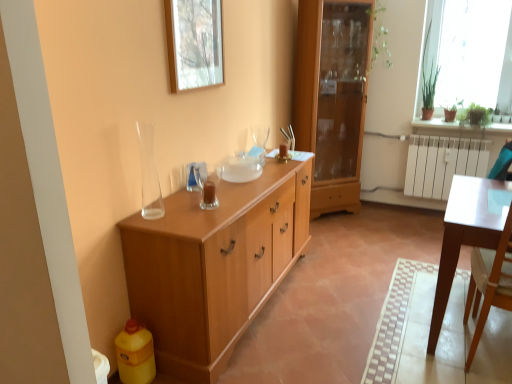
You are a GUI agent. You are given a task and a screenshot of the screen. Output one action in this format:
    pyautogui.click(x=<x>, y=<y>)
    Task: Click on the translucent glass candle at center
    The width and height of the screenshot is (512, 384).
    Given the screenshot: What is the action you would take?
    pyautogui.click(x=208, y=186)

Image resolution: width=512 pixels, height=384 pixels. What do you see at coordinates (332, 97) in the screenshot? I see `light brown wood cabinet at center` at bounding box center [332, 97].

What do you see at coordinates (194, 43) in the screenshot? I see `wooden picture frame at upper center` at bounding box center [194, 43].

What do you see at coordinates (149, 174) in the screenshot? I see `transparent glass vase at left` at bounding box center [149, 174].

Image resolution: width=512 pixels, height=384 pixels. What do you see at coordinates (489, 283) in the screenshot?
I see `white glossy table at right` at bounding box center [489, 283].

Identify the location of translucent glass candle at center. The height and width of the screenshot is (384, 512). (208, 186).

Is transparent glass vase at left aimed at white glossy table at right?

No, transparent glass vase at left is not turned towards white glossy table at right.

Does point (150, 126) come closer to viewer compared to point (505, 301)?

No, (150, 126) is further to viewer.

Considering the sizes of transparent glass vase at left and white glossy table at right in the image, is transparent glass vase at left taller or shorter than white glossy table at right?

In the image, transparent glass vase at left appears to be shorter than white glossy table at right.

Which of these two, transparent glass vase at left or white glossy table at right, is thinner?

transparent glass vase at left.

From a real-world perspective, which is physically below, white glossy table at right or transparent glass vase at left?

white glossy table at right.

Based on their sizes in the image, would you say white glossy table at right is bigger or smaller than transparent glass vase at left?

Clearly, white glossy table at right is larger in size than transparent glass vase at left.

The image size is (512, 384). I want to click on glass vase behind the white glossy table at right, so click(x=149, y=174).

Which object is more forward, white glossy table at right or transparent glass vase at left?

white glossy table at right.

Would you say transparent glass vase at left is to the left or to the right of wooden picture frame at upper center in the picture?

transparent glass vase at left is to the left of wooden picture frame at upper center.

Is transparent glass vase at left completely or partially outside of wooden picture frame at upper center?

Indeed, transparent glass vase at left is completely outside wooden picture frame at upper center.

How much distance is there between transparent glass vase at left and wooden picture frame at upper center?

They are 20.59 inches apart.

Is light brown wood cabinet at center to the left of wooden cabinet at center from the viewer's perspective?

No, light brown wood cabinet at center is not to the left of wooden cabinet at center.

Is point (321, 110) behind point (165, 294)?

Yes, it is.

Is light brown wood cabinet at center aimed at wooden cabinet at center?

No, light brown wood cabinet at center does not turn towards wooden cabinet at center.

Is wooden picture frame at upper center turned away from transparent glass vase at left?

No, wooden picture frame at upper center's orientation is not away from transparent glass vase at left.

Considering the relative sizes of wooden picture frame at upper center and transparent glass vase at left in the image provided, is wooden picture frame at upper center wider than transparent glass vase at left?

No, wooden picture frame at upper center is not wider than transparent glass vase at left.

Considering the sizes of wooden picture frame at upper center and transparent glass vase at left in the image, is wooden picture frame at upper center taller or shorter than transparent glass vase at left?

Clearly, wooden picture frame at upper center is taller compared to transparent glass vase at left.

How distant is wooden picture frame at upper center from transparent glass vase at left?

wooden picture frame at upper center and transparent glass vase at left are 20.59 inches apart.

Is light brown wood cabinet at center positioned with its back to transparent glass vase at left?

light brown wood cabinet at center is not turned away from transparent glass vase at left.

From their relative heights in the image, would you say light brown wood cabinet at center is taller or shorter than transparent glass vase at left?

Clearly, light brown wood cabinet at center is taller compared to transparent glass vase at left.

Looking at their sizes, would you say light brown wood cabinet at center is wider or thinner than transparent glass vase at left?

Considering their sizes, light brown wood cabinet at center looks broader than transparent glass vase at left.

Is translucent glass candle at center outside of transparent glass vase at left?

That's correct, translucent glass candle at center is outside of transparent glass vase at left.

Does translucent glass candle at center come in front of transparent glass vase at left?

No, it is behind transparent glass vase at left.

Does point (204, 193) come farther from viewer compared to point (156, 180)?

No, it is in front of (156, 180).

Is translucent glass candle at center bigger or smaller than transparent glass vase at left?

Clearly, translucent glass candle at center is smaller in size than transparent glass vase at left.

At what (x,y) coordinates should I click in order to perform the action: click on armchair in front of the transparent glass vase at left. Please return your answer as a coordinate pair (x, y). The image size is (512, 384). Looking at the image, I should click on pyautogui.click(x=489, y=283).

You are a GUI agent. You are given a task and a screenshot of the screen. Output one action in this format:
    pyautogui.click(x=<x>, y=<y>)
    Task: Click on the armchair directly beneath the transparent glass vase at left (from a real-world perspective)
    
    Given the screenshot: What is the action you would take?
    pyautogui.click(x=489, y=283)

Looking at the image, which one is located closer to wooden cabinet at center, light brown wood cabinet at center or white glossy table at right?

Based on the image, white glossy table at right appears to be nearer to wooden cabinet at center.

Looking at the image, which one is located further to transparent glass vase at left, wooden cabinet at center or translucent glass candle at center?

wooden cabinet at center is positioned further to the anchor transparent glass vase at left.

Consider the image. Considering their positions, is wooden picture frame at upper center positioned further to translucent glass candle at center than white glossy table at right?

Based on the image, white glossy table at right appears to be further to translucent glass candle at center.

Based on the photo, based on their spatial positions, is translucent glass candle at center or white glossy table at right further from transparent glass vase at left?

The object further to transparent glass vase at left is white glossy table at right.

Based on their spatial positions, is transparent glass vase at left or wooden picture frame at upper center closer to translucent glass candle at center?

transparent glass vase at left.

When comparing their distances from translucent glass candle at center, does wooden picture frame at upper center or transparent glass vase at left seem closer?

The object closer to translucent glass candle at center is transparent glass vase at left.

Based on their spatial positions, is wooden cabinet at center or light brown wood cabinet at center closer to translucent glass candle at center?

Among the two, wooden cabinet at center is located nearer to translucent glass candle at center.

Based on their spatial positions, is translucent glass candle at center or wooden cabinet at center further from wooden picture frame at upper center?

wooden cabinet at center.

Locate an element on the screen. The image size is (512, 384). chest of drawers between white glossy table at right and light brown wood cabinet at center in the front-back direction is located at coordinates (214, 265).

Where is `picture frame positioned between transparent glass vase at left and light brown wood cabinet at center from near to far`? Image resolution: width=512 pixels, height=384 pixels. picture frame positioned between transparent glass vase at left and light brown wood cabinet at center from near to far is located at coordinates [194, 43].

At what (x,y) coordinates should I click in order to perform the action: click on cabinetry between transparent glass vase at left and white glossy table at right in the horizontal direction. Please return your answer as a coordinate pair (x, y). Image resolution: width=512 pixels, height=384 pixels. Looking at the image, I should click on (332, 97).

Where is `glass vase that lies between wooden picture frame at upper center and wooden cabinet at center from top to bottom`? glass vase that lies between wooden picture frame at upper center and wooden cabinet at center from top to bottom is located at coordinates (149, 174).